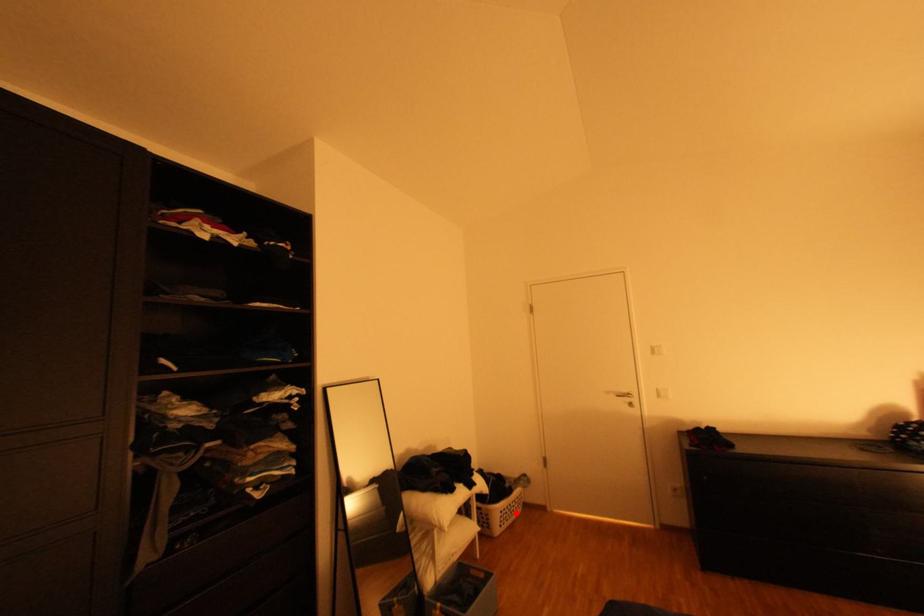
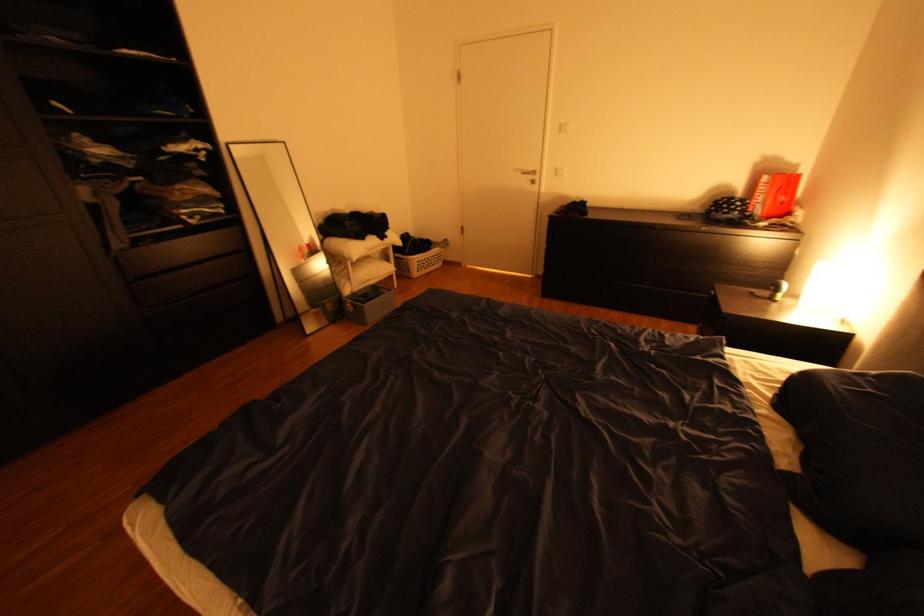
Question: A red point is marked in image1. In image2, is the corresponding 3D point closer to the camera or farther? Reply with the corresponding letter.

Choices:
 (A) The corresponding 3D point is closer.
 (B) The corresponding 3D point is farther.

Answer: (A)